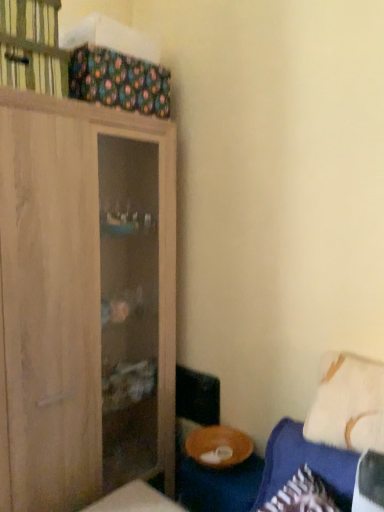
Question: Looking at the image, does blue fabric couch at lower right seem bigger or smaller compared to wooden bowl at lower right?

Choices:
 (A) big
 (B) small

Answer: (A)

Question: Which is correct: blue fabric couch at lower right is inside wooden bowl at lower right, or outside of it?

Choices:
 (A) outside
 (B) inside

Answer: (A)

Question: Based on their relative distances, which object is nearer to the wooden bowl at lower right?

Choices:
 (A) blue fabric couch at lower right
 (B) wooden cabinet at upper left
 (C) light wood cabinet at left
 (D) white soft pillow at lower right

Answer: (A)

Question: Considering the real-world distances, which object is farthest from the blue fabric couch at lower right?

Choices:
 (A) light wood cabinet at left
 (B) white soft pillow at lower right
 (C) wooden bowl at lower right
 (D) wooden cabinet at upper left

Answer: (D)